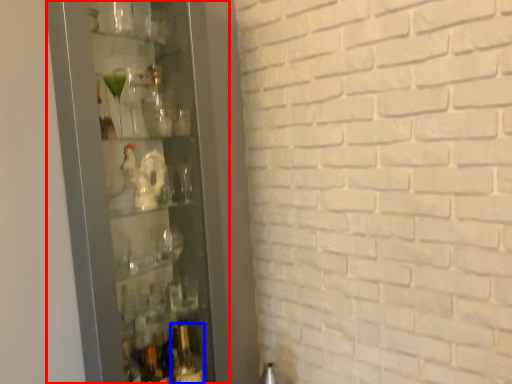
Question: Which of the following is the farthest to the observer, glass door (highlighted by a red box) or bottle (highlighted by a blue box)?

Choices:
 (A) glass door
 (B) bottle

Answer: (B)